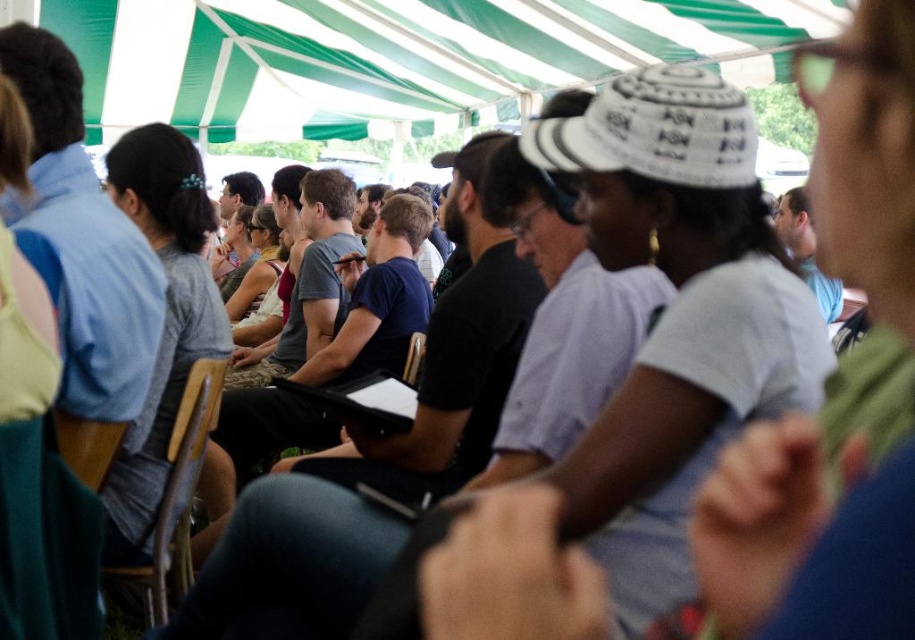
Question: Can you confirm if wooden chair at center is thinner than wooden chair at lower left?

Choices:
 (A) no
 (B) yes

Answer: (A)

Question: Among these points, which one is nearest to the camera?

Choices:
 (A) (106, 454)
 (B) (203, 371)

Answer: (A)

Question: Can you confirm if wooden chair at center is bigger than wooden chair at lower left?

Choices:
 (A) yes
 (B) no

Answer: (A)

Question: Is wooden chair at center thinner than wooden chair at lower left?

Choices:
 (A) yes
 (B) no

Answer: (B)